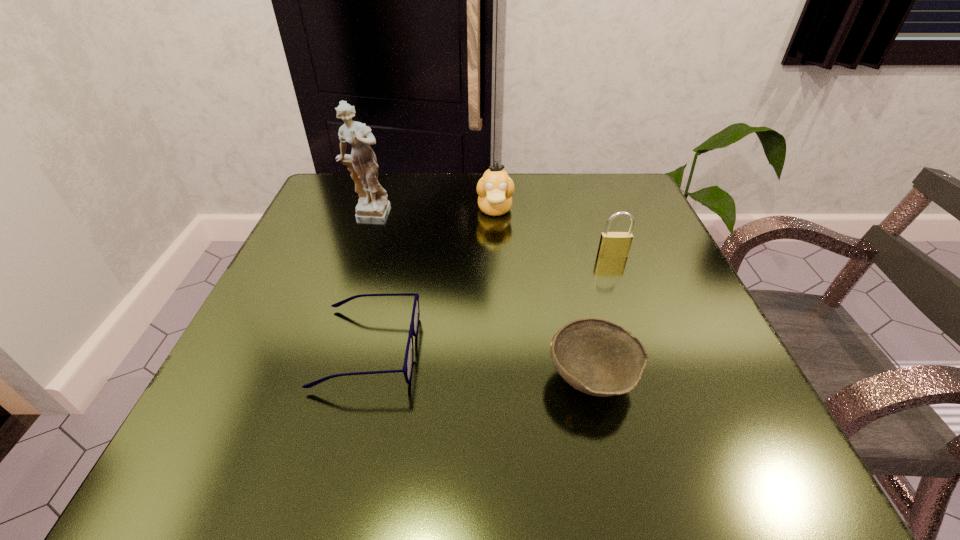
Find the location of a particular element. Image resolution: width=960 pixels, height=540 pixels. figurine is located at coordinates (373, 208).

Where is `the third object from left to right`? the third object from left to right is located at coordinates (495, 188).

In order to click on padlock in this screenshot , I will do `click(612, 244)`.

Identify the location of the third tallest object. This screenshot has width=960, height=540. [x=612, y=244].

In order to click on bowl in this screenshot , I will do `click(595, 356)`.

Where is `spectacles`? This screenshot has width=960, height=540. spectacles is located at coordinates (407, 369).

Locate an element on the screen. blank space located on the front-facing side of the tallest object is located at coordinates (338, 306).

At what (x,y) coordinates should I click in order to perform the action: click on blank space located 0.270m on the face of the duckling. Please return your answer as a coordinate pair (x, y). Image resolution: width=960 pixels, height=540 pixels. Looking at the image, I should click on (500, 314).

Find the location of `vacant space located on the front-facing side of the third nearest object`. vacant space located on the front-facing side of the third nearest object is located at coordinates (621, 278).

Identify the location of free space located on the back of the fourth tallest object. The height and width of the screenshot is (540, 960). (578, 317).